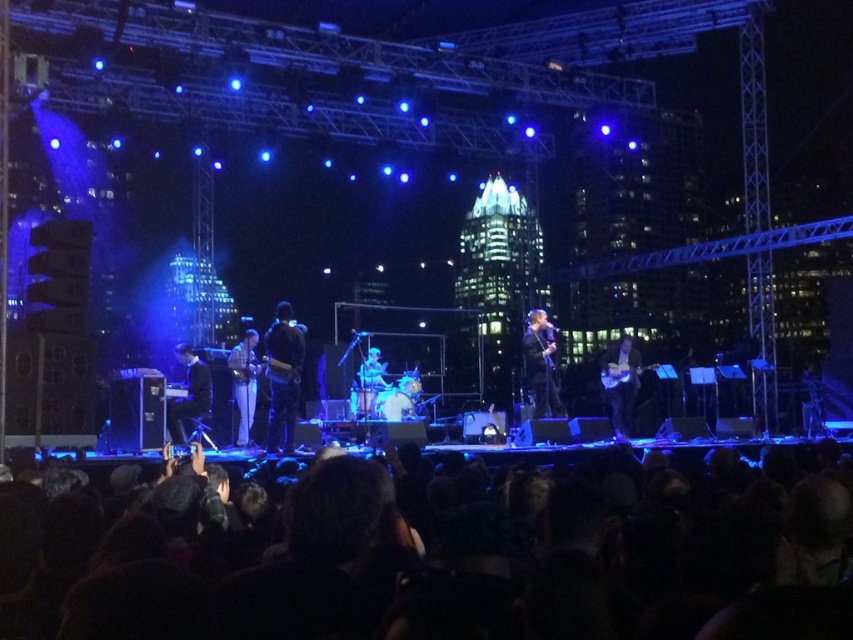
Question: Among these points, which one is farthest from the camera?

Choices:
 (A) (296, 408)
 (B) (531, 364)
 (C) (183, 481)

Answer: (B)

Question: Can you confirm if shiny black jacket at center is thinner than light brown wood guitar at center?

Choices:
 (A) no
 (B) yes

Answer: (A)

Question: Can you confirm if light brown wood guitar at center is positioned to the left of matte blue drum set at center?

Choices:
 (A) no
 (B) yes

Answer: (B)

Question: Which of the following is the farthest from the observer?

Choices:
 (A) (538, 374)
 (B) (631, 374)
 (C) (286, 442)

Answer: (B)

Question: Estimate the real-world distances between objects in this image. Which object is farther from the matte blue drum set at center?

Choices:
 (A) shiny black jacket at center
 (B) dark fabric jacket at center

Answer: (A)

Question: In this image, where is dark fabric jacket at center located relative to shiny black jacket at center?

Choices:
 (A) below
 (B) above

Answer: (A)